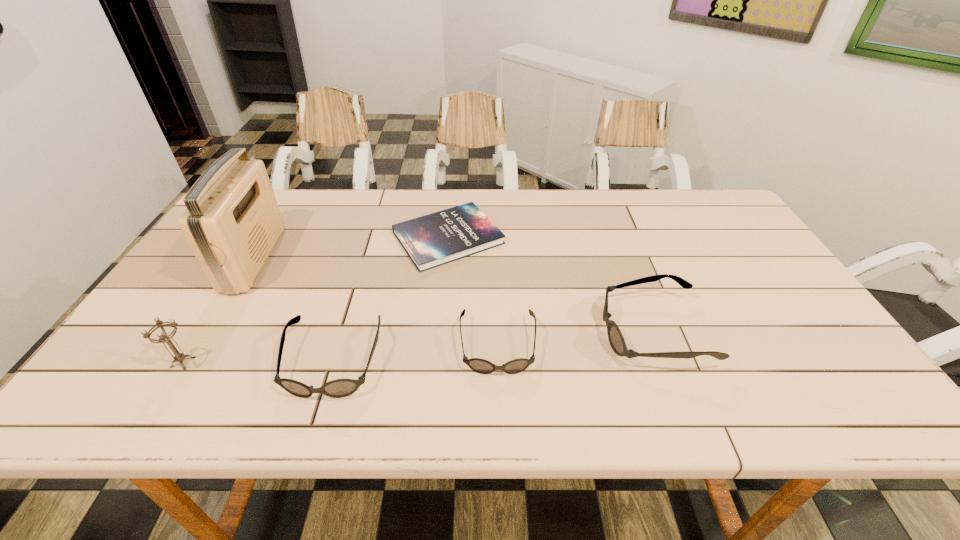
Locate an element on the screen. This screenshot has width=960, height=540. free point located on the lenses of the rightmost sunglasses is located at coordinates (459, 332).

Locate an element on the screen. The height and width of the screenshot is (540, 960). free space located 0.370m on the right of the hardback book is located at coordinates (629, 238).

Where is `vacant point located on the front-facing side of the radio receiver`? The height and width of the screenshot is (540, 960). vacant point located on the front-facing side of the radio receiver is located at coordinates (377, 259).

You are a GUI agent. You are given a task and a screenshot of the screen. Output one action in this format:
    pyautogui.click(x=<x>, y=<y>)
    Task: Click on the vacant space located on the right of the candle holder
    
    Given the screenshot: What is the action you would take?
    pyautogui.click(x=218, y=362)

This screenshot has height=540, width=960. Identify the location of hardback book located at the far edge. (432, 240).

Locate an element on the screen. Image resolution: width=960 pixels, height=540 pixels. radio receiver located in the far edge section of the desktop is located at coordinates (232, 222).

Identify the location of candle holder at the near edge. The width and height of the screenshot is (960, 540). (163, 337).

Find the location of a particular element. radio receiver located in the left edge section of the desktop is located at coordinates (232, 222).

What are the coordinates of `candle holder that is at the left edge` in the screenshot? It's located at (163, 337).

Find the location of `object at the far left corner`. object at the far left corner is located at coordinates (232, 222).